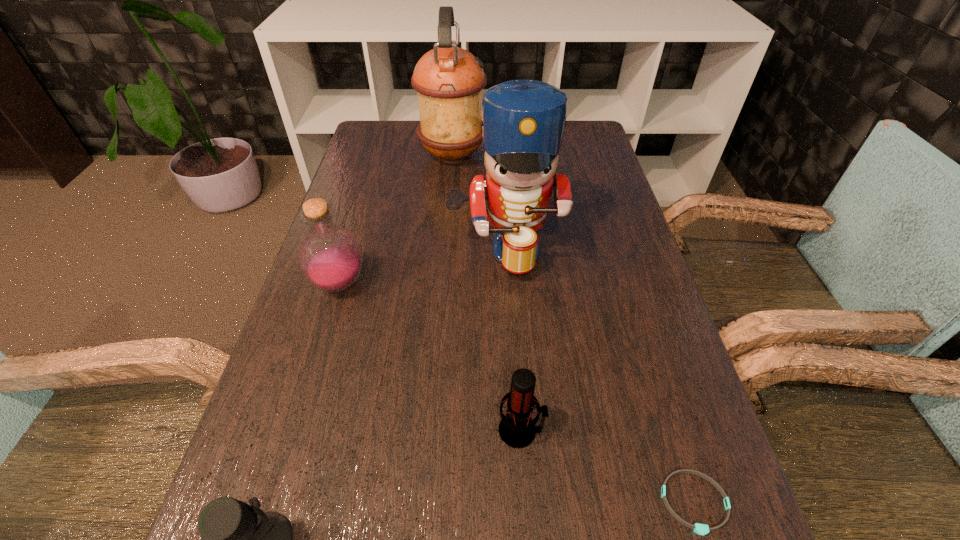
The image size is (960, 540). What are the coordinates of `oil lamp` in the screenshot? It's located at (449, 80).

Find the location of `nutcracker`. nutcracker is located at coordinates (523, 121).

Image resolution: width=960 pixels, height=540 pixels. In order to click on bottle in this screenshot , I will do `click(330, 257)`.

The width and height of the screenshot is (960, 540). I want to click on the fourth farthest object, so click(x=517, y=430).

At what (x,y) coordinates should I click in order to perform the action: click on the right microphone. Please return your answer as a coordinate pair (x, y). This screenshot has width=960, height=540. Looking at the image, I should click on (517, 430).

Locate an element on the screen. wristband is located at coordinates (702, 529).

Find the location of a particular element. This screenshot has width=960, height=540. the rightmost object is located at coordinates (702, 529).

The height and width of the screenshot is (540, 960). In order to click on free space located 0.260m on the right of the farthest object in this screenshot , I will do `click(570, 156)`.

This screenshot has width=960, height=540. Identify the location of vacant position located 0.140m on the front-facing side of the nutcracker. (510, 335).

The image size is (960, 540). In order to click on free point located on the right of the bottle in this screenshot , I will do `click(435, 285)`.